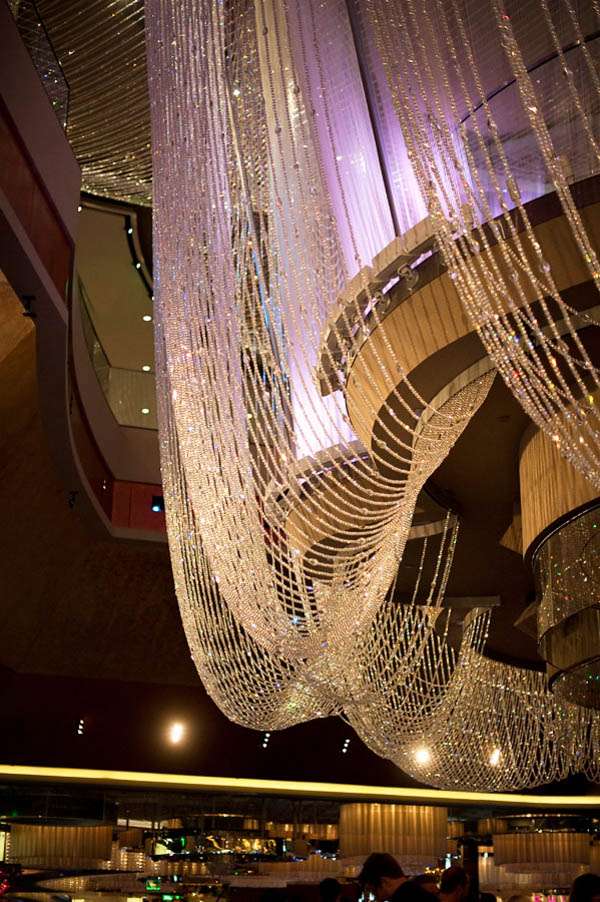
Where is `green lights`? green lights is located at coordinates (168, 899), (157, 888), (182, 842).